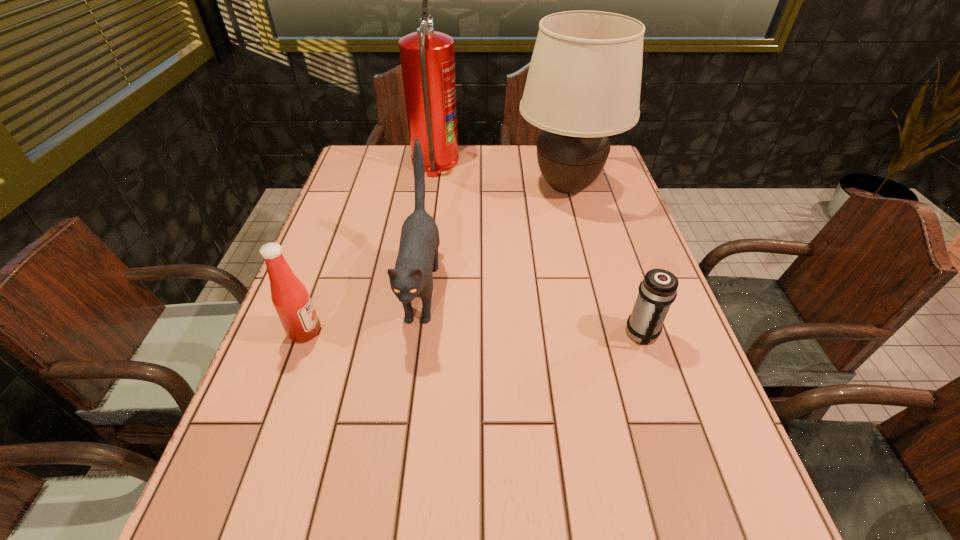
The height and width of the screenshot is (540, 960). In order to click on vacant area situated 0.210m on the side with the handle of the shortest object in this screenshot , I will do `click(681, 449)`.

At what (x,y) coordinates should I click in order to perform the action: click on fire extinguisher that is at the far edge. Please return your answer as a coordinate pair (x, y). The height and width of the screenshot is (540, 960). Looking at the image, I should click on (427, 57).

I want to click on lampshade situated at the far edge, so click(x=583, y=85).

Image resolution: width=960 pixels, height=540 pixels. I want to click on object that is at the left edge, so click(289, 295).

You are a GUI agent. You are given a task and a screenshot of the screen. Output one action in this format:
    pyautogui.click(x=<x>, y=<y>)
    Task: Click on the lampshade that is at the right edge
    Image resolution: width=960 pixels, height=540 pixels.
    Given the screenshot: What is the action you would take?
    pyautogui.click(x=583, y=85)

Where is `thermos bottle positioned at the right edge`? Image resolution: width=960 pixels, height=540 pixels. thermos bottle positioned at the right edge is located at coordinates (658, 290).

Locate an element on the screen. This screenshot has width=960, height=540. object situated at the far right corner is located at coordinates (583, 85).

I want to click on free space at the far edge, so click(537, 163).

The height and width of the screenshot is (540, 960). Find the location of `vacant area at the near edge`. vacant area at the near edge is located at coordinates (393, 523).

This screenshot has height=540, width=960. What are the coordinates of `vacant position at the left edge of the desktop` in the screenshot? It's located at (373, 188).